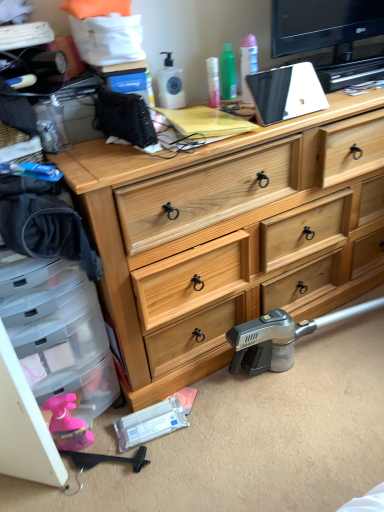
The width and height of the screenshot is (384, 512). Describe the element at coordinates (216, 239) in the screenshot. I see `natural wood chest of drawers at center` at that location.

What are the coordinates of `natural wood chest of drawers at center` in the screenshot? It's located at (216, 239).

This screenshot has height=512, width=384. Describe the element at coordinates (106, 459) in the screenshot. I see `black plastic hammer at lower left` at that location.

Locate an element on the screen. black plastic hammer at lower left is located at coordinates (106, 459).

Identify the location of natural wood chest of drawers at center. (216, 239).

Between natural wood chest of drawers at center and black plastic hammer at lower left, which one appears on the right side from the viewer's perspective?

From the viewer's perspective, natural wood chest of drawers at center appears more on the right side.

Which object is closer to the camera taking this photo, natural wood chest of drawers at center or black plastic hammer at lower left?

natural wood chest of drawers at center is more forward.

Does point (84, 220) come closer to viewer compared to point (143, 453)?

That is True.

From the image's perspective, is natural wood chest of drawers at center positioned above or below black plastic hammer at lower left?

From the image's perspective, natural wood chest of drawers at center appears above black plastic hammer at lower left.

Based on the photo, from a real-world perspective, which object stands above the other?

natural wood chest of drawers at center is physically above.

Considering the relative sizes of natural wood chest of drawers at center and black plastic hammer at lower left in the image provided, is natural wood chest of drawers at center thinner than black plastic hammer at lower left?

No.

Is natural wood chest of drawers at center taller than black plastic hammer at lower left?

Yes.

In terms of size, does natural wood chest of drawers at center appear bigger or smaller than black plastic hammer at lower left?

natural wood chest of drawers at center is bigger than black plastic hammer at lower left.

Is natural wood chest of drawers at center inside or outside of black plastic hammer at lower left?

natural wood chest of drawers at center exists outside the volume of black plastic hammer at lower left.

Is there a large distance between natural wood chest of drawers at center and black plastic hammer at lower left?

Actually, natural wood chest of drawers at center and black plastic hammer at lower left are a little close together.

Does natural wood chest of drawers at center turn towards black plastic hammer at lower left?

No.

This screenshot has height=512, width=384. In order to click on the chest of drawers lying above the black plastic hammer at lower left (from the image's perspective) in this screenshot , I will do `click(216, 239)`.

Would you say black plastic hammer at lower left is to the left or to the right of natural wood chest of drawers at center in the picture?

From the image, it's evident that black plastic hammer at lower left is to the left of natural wood chest of drawers at center.

Is the depth of black plastic hammer at lower left greater than that of natural wood chest of drawers at center?

Yes, black plastic hammer at lower left is behind natural wood chest of drawers at center.

Considering the points (140, 447) and (62, 166), which point is behind, point (140, 447) or point (62, 166)?

Point (140, 447)

From the image's perspective, which is below, black plastic hammer at lower left or natural wood chest of drawers at center?

From the image's view, black plastic hammer at lower left is below.

From a real-world perspective, between black plastic hammer at lower left and natural wood chest of drawers at center, who is vertically lower?

black plastic hammer at lower left, from a real-world perspective.

Consider the image. Can you confirm if black plastic hammer at lower left is wider than natural wood chest of drawers at center?

In fact, black plastic hammer at lower left might be narrower than natural wood chest of drawers at center.

Considering the sizes of black plastic hammer at lower left and natural wood chest of drawers at center in the image, is black plastic hammer at lower left taller or shorter than natural wood chest of drawers at center?

Clearly, black plastic hammer at lower left is shorter compared to natural wood chest of drawers at center.

Is black plastic hammer at lower left bigger than natural wood chest of drawers at center?

No, black plastic hammer at lower left is not bigger than natural wood chest of drawers at center.

Is natural wood chest of drawers at center inside black plastic hammer at lower left?

A: That's incorrect, natural wood chest of drawers at center is not inside black plastic hammer at lower left.

Is black plastic hammer at lower left not close to natural wood chest of drawers at center?

They are positioned close to each other.

Is black plastic hammer at lower left turned away from natural wood chest of drawers at center?

black plastic hammer at lower left is not turned away from natural wood chest of drawers at center.

How different are the orientations of black plastic hammer at lower left and natural wood chest of drawers at center in degrees?

There is a 57.8-degree angle between the facing directions of black plastic hammer at lower left and natural wood chest of drawers at center.

The height and width of the screenshot is (512, 384). Identify the location of weapon that is under the natural wood chest of drawers at center (from a real-world perspective). (106, 459).

This screenshot has height=512, width=384. Identify the location of weapon that is on the left side of natural wood chest of drawers at center. (106, 459).

Find the location of `weapon behind the natural wood chest of drawers at center`. weapon behind the natural wood chest of drawers at center is located at coordinates (106, 459).